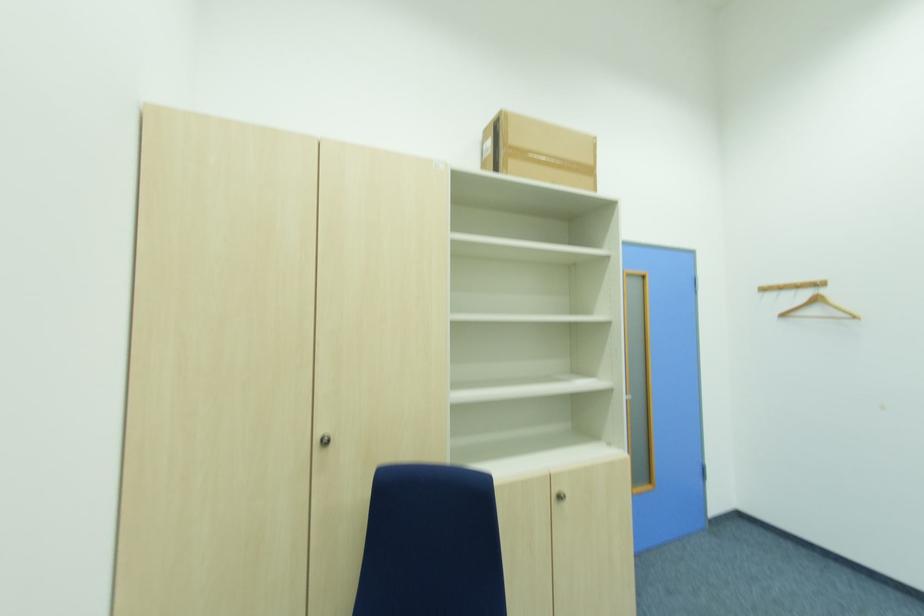
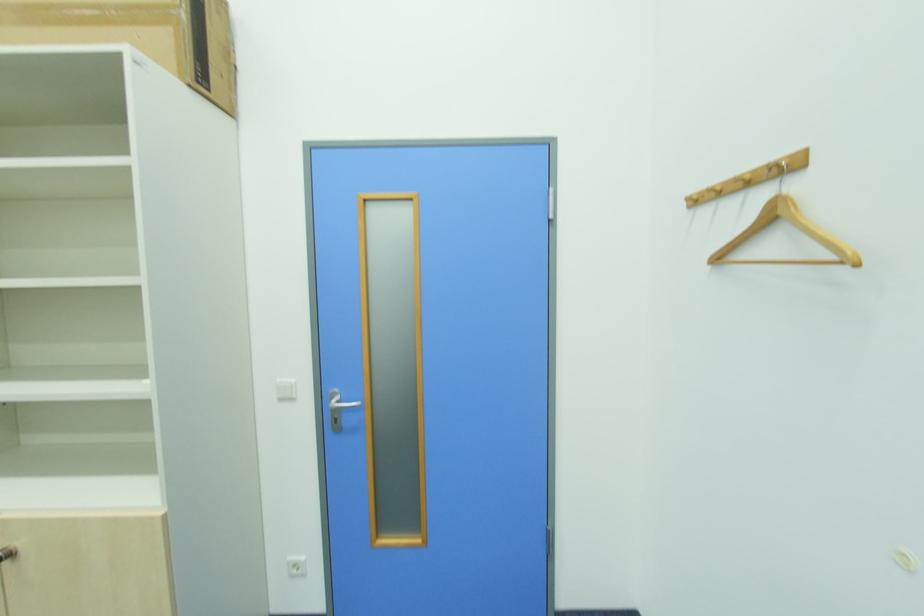
The images are taken continuously from a first-person perspective. In which direction are you moving?

The movement direction of the cameraman is right, forward.